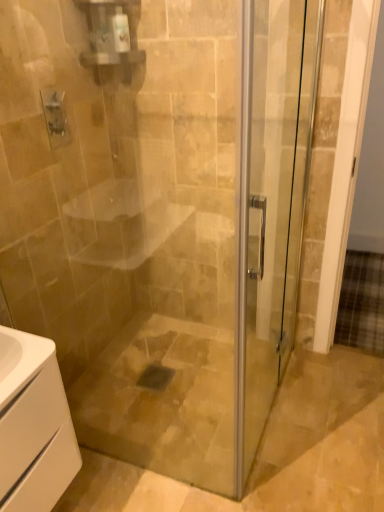
Question: From a real-world perspective, is white matte cabinet at lower left above or below transparent glass shower door at right?

Choices:
 (A) below
 (B) above

Answer: (A)

Question: Is white matte cabinet at lower left taller or shorter than transparent glass shower door at right?

Choices:
 (A) tall
 (B) short

Answer: (B)

Question: From the image's perspective, is white matte cabinet at lower left positioned above or below transparent glass shower door at right?

Choices:
 (A) below
 (B) above

Answer: (A)

Question: Is transparent glass shower door at right in front of or behind white matte cabinet at lower left in the image?

Choices:
 (A) front
 (B) behind

Answer: (A)

Question: Considering the positions of transparent glass shower door at right and white matte cabinet at lower left in the image, is transparent glass shower door at right wider or thinner than white matte cabinet at lower left?

Choices:
 (A) wide
 (B) thin

Answer: (B)

Question: From a real-world perspective, is transparent glass shower door at right above or below white matte cabinet at lower left?

Choices:
 (A) above
 (B) below

Answer: (A)

Question: Considering the positions of transparent glass shower door at right and white matte cabinet at lower left in the image, is transparent glass shower door at right bigger or smaller than white matte cabinet at lower left?

Choices:
 (A) small
 (B) big

Answer: (B)